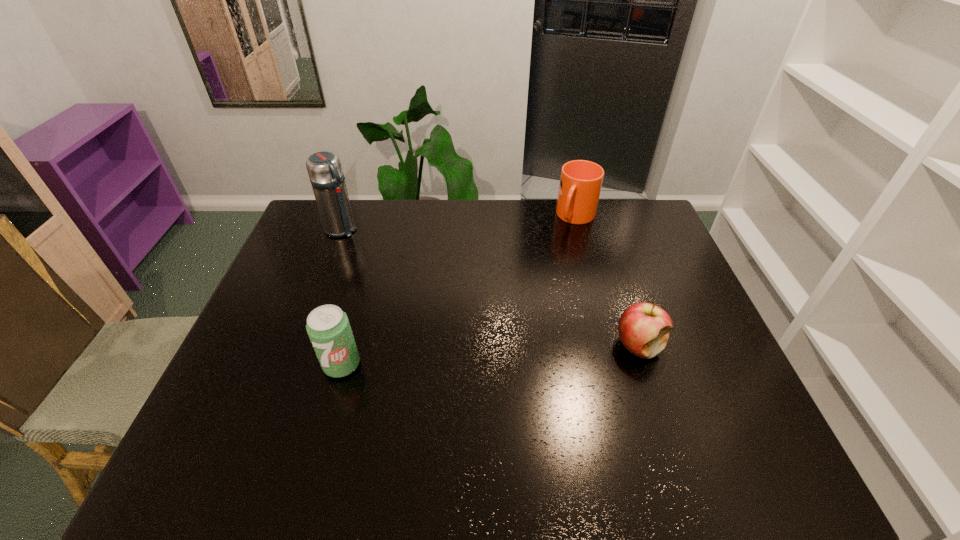
You are a GUI agent. You are given a task and a screenshot of the screen. Output one action in this format:
    pyautogui.click(x=<x>, y=<y>)
    Task: Click on the vacant space at the left edge of the desktop
    The width and height of the screenshot is (960, 540).
    Given the screenshot: What is the action you would take?
    click(287, 278)

In order to click on blank area at the right edge in this screenshot , I will do `click(634, 281)`.

You are a GUI agent. You are given a task and a screenshot of the screen. Output one action in this format:
    pyautogui.click(x=<x>, y=<y>)
    Task: Click on the free region at the near left corner of the desktop
    The width and height of the screenshot is (960, 540).
    Given the screenshot: What is the action you would take?
    pyautogui.click(x=238, y=413)

This screenshot has width=960, height=540. I want to click on free spot between the mug and the shortest object, so click(x=608, y=281).

Locate an element on the screen. The image size is (960, 540). free area in between the soda and the shortest object is located at coordinates pos(491,355).

This screenshot has width=960, height=540. In order to click on vacant space that is in between the mug and the third object from right to left in this screenshot , I will do `click(459, 291)`.

Where is `unoccupied area between the mug and the shortest object`? unoccupied area between the mug and the shortest object is located at coordinates pyautogui.click(x=608, y=281).

Where is `vacant point located between the apple and the mug`? The width and height of the screenshot is (960, 540). vacant point located between the apple and the mug is located at coordinates tap(608, 281).

This screenshot has height=540, width=960. In order to click on free point between the shortest object and the mug in this screenshot , I will do `click(608, 281)`.

Find the location of `free area in between the shortest object and the mug`. free area in between the shortest object and the mug is located at coordinates (608, 281).